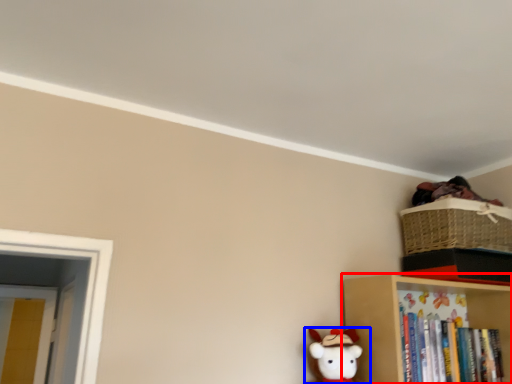
Question: Among these objects, which one is nearest to the camera, shelf (highlighted by a red box) or toy (highlighted by a blue box)?

Choices:
 (A) shelf
 (B) toy

Answer: (B)